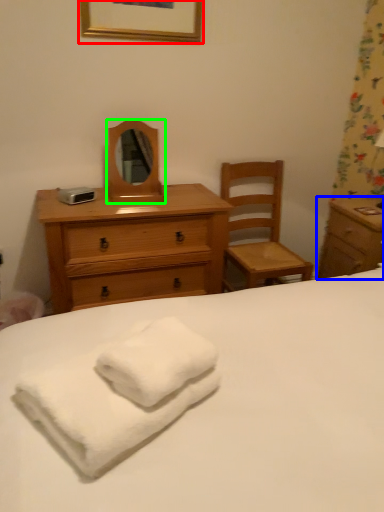
Question: Considering the real-world distances, which object is farthest from picture frame (highlighted by a red box)? nightstand (highlighted by a blue box) or mirror (highlighted by a green box)?

Choices:
 (A) nightstand
 (B) mirror

Answer: (A)